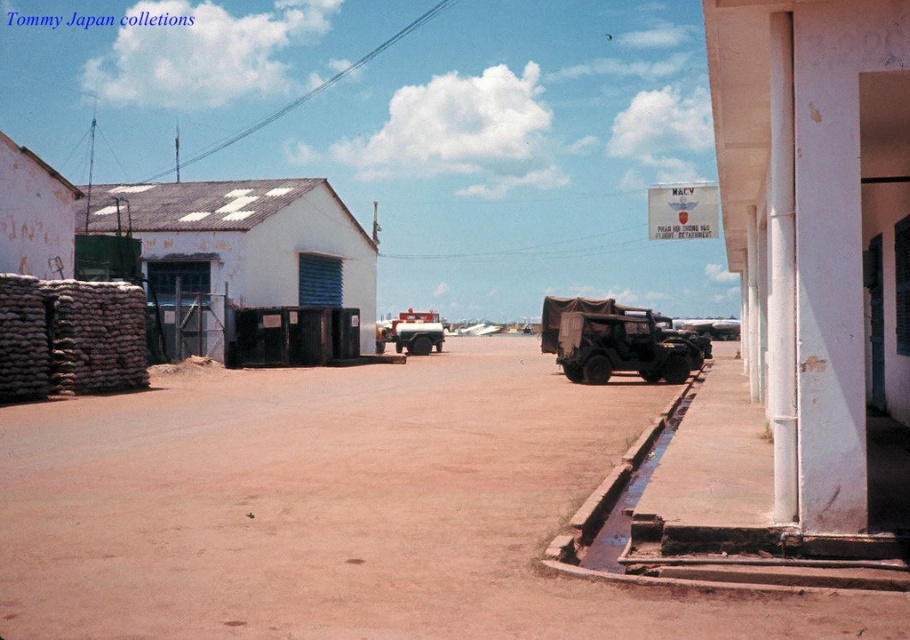
Question: Is camouflage fabric jeep at center in front of matte red truck at center?

Choices:
 (A) no
 (B) yes

Answer: (B)

Question: Does camouflage fabric jeep at center appear on the left side of matte red truck at center?

Choices:
 (A) yes
 (B) no

Answer: (B)

Question: Among these points, which one is nearest to the camera?

Choices:
 (A) (624, 333)
 (B) (421, 353)

Answer: (A)

Question: Which is nearer to the matte red truck at center?

Choices:
 (A) camouflage fabric jeep at center
 (B) brown dirt track at center

Answer: (A)

Question: Can you confirm if camouflage fabric jeep at center is positioned below matte red truck at center?

Choices:
 (A) yes
 (B) no

Answer: (A)

Question: Estimate the real-world distances between objects in this image. Which object is closer to the camouflage fabric jeep at center?

Choices:
 (A) brown dirt track at center
 (B) matte red truck at center

Answer: (A)